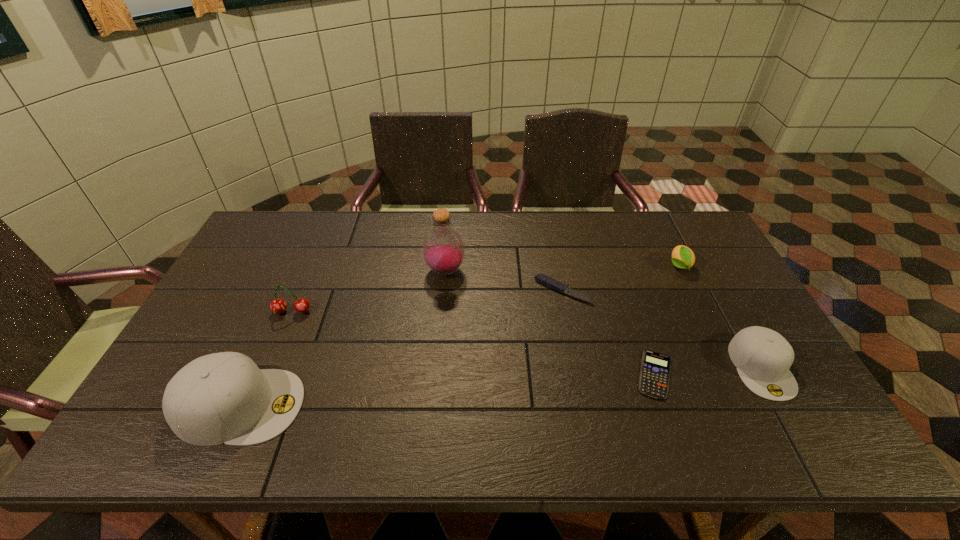
The image size is (960, 540). I want to click on vacant position in the image that satisfies the following two spatial constraints: 1. on the front side of the shortest object; 2. on the right side of the steak knife, so click(579, 374).

Where is `vacant region that satisfies the following two spatial constraints: 1. with leaves positioned above the fifth tallest object; 2. on the front-facing side of the sixth shortest object`? vacant region that satisfies the following two spatial constraints: 1. with leaves positioned above the fifth tallest object; 2. on the front-facing side of the sixth shortest object is located at coordinates (748, 406).